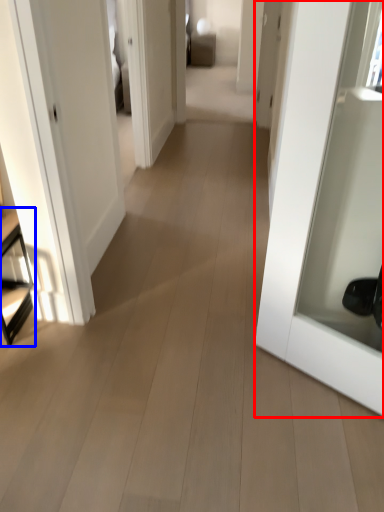
Question: Which object appears farthest to the camera in this image, door (highlighted by a red box) or furniture (highlighted by a blue box)?

Choices:
 (A) door
 (B) furniture

Answer: (B)